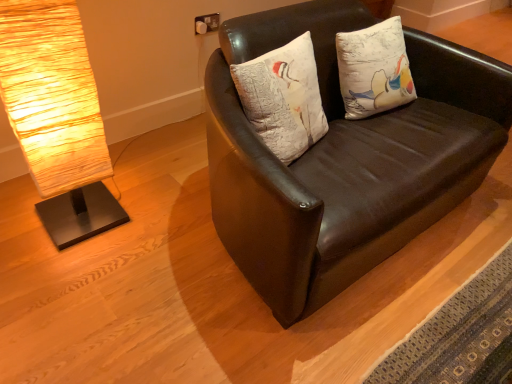
This screenshot has height=384, width=512. In order to click on free spot to the right of rustic wood lamp at left in this screenshot , I will do `click(145, 224)`.